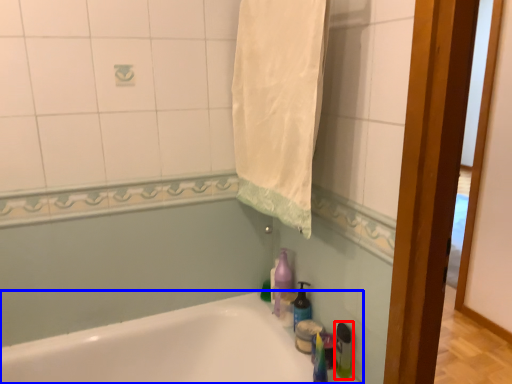
Question: Which object is closer to the camera taking this photo, bottle (highlighted by a red box) or bathtub (highlighted by a blue box)?

Choices:
 (A) bottle
 (B) bathtub

Answer: (B)